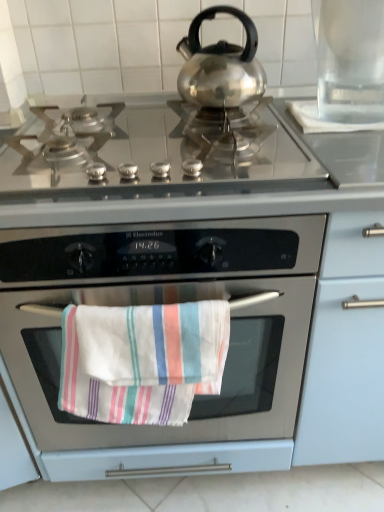
Question: Considering their positions, is stainless steel oven at center located in front of or behind transparent glass pitcher at upper right?

Choices:
 (A) front
 (B) behind

Answer: (A)

Question: Is stainless steel oven at center spatially inside transparent glass pitcher at upper right, or outside of it?

Choices:
 (A) inside
 (B) outside

Answer: (B)

Question: Estimate the real-world distances between objects in this image. Which object is closer to the transparent glass pitcher at upper right?

Choices:
 (A) white striped towel at center
 (B) stainless steel oven at center
 (C) stainless steel cooktop at center

Answer: (C)

Question: Based on their relative distances, which object is farther from the stainless steel oven at center?

Choices:
 (A) transparent glass pitcher at upper right
 (B) stainless steel cooktop at center
 (C) white striped towel at center

Answer: (A)